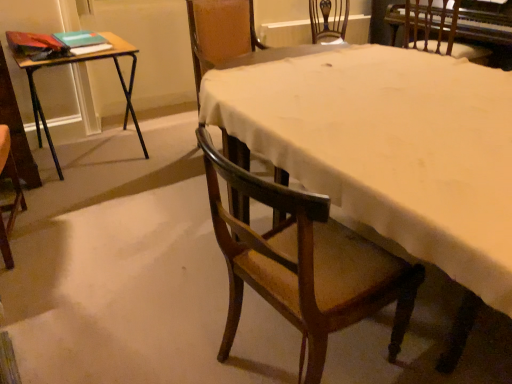
Question: From the image's perspective, is white cloth at center positioned above or below green matte book at upper left, which ranks as the 2th book in top-to-bottom order?

Choices:
 (A) above
 (B) below

Answer: (B)

Question: Looking at their shapes, would you say white cloth at center is wider or thinner than green matte book at upper left, arranged as the 1th book when ordered from the bottom?

Choices:
 (A) thin
 (B) wide

Answer: (B)

Question: Considering the real-world distances, which object is farthest from the green matte book at upper left, which is the second book from bottom to top?

Choices:
 (A) wooden chair at center, acting as the 1th chair starting from the left
 (B) green matte book at upper left, arranged as the 1th book when ordered from the bottom
 (C) white cloth at center
 (D) wooden folding table at left
 (E) wooden chair at lower right, marked as the 2th chair in a left-to-right arrangement

Answer: (E)

Question: Estimate the real-world distances between objects in this image. Which object is closer to the green matte book at upper left, arranged as the 1th book when ordered from the bottom?

Choices:
 (A) wooden chair at center, the 2th chair when ordered from back to front
 (B) green matte book at upper left, which is the second book from bottom to top
 (C) wooden chair at upper right, which appears as the third chair when viewed from the left
 (D) white cloth at center
 (E) wooden chair at lower right, the third chair viewed from the back

Answer: (B)